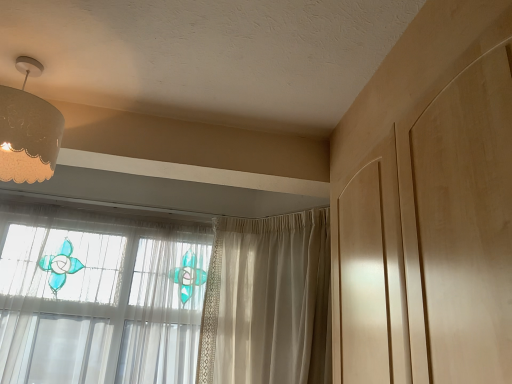
Describe the element at coordinates (28, 130) in the screenshot. I see `matte white lampshade at upper left` at that location.

This screenshot has height=384, width=512. What are the coordinates of `matte white lampshade at upper left` in the screenshot? It's located at (28, 130).

This screenshot has width=512, height=384. What do you see at coordinates (268, 301) in the screenshot?
I see `sheer beige curtain at center` at bounding box center [268, 301].

The width and height of the screenshot is (512, 384). I want to click on sheer beige curtain at center, so click(268, 301).

You are a GUI agent. You are given a task and a screenshot of the screen. Output one action in this format:
    pyautogui.click(x=<x>, y=<y>)
    Task: Click on the matte white lampshade at upper left
    Image resolution: width=512 pixels, height=384 pixels.
    Given the screenshot: What is the action you would take?
    pyautogui.click(x=28, y=130)

Considering the positions of objects matte white lampshade at upper left and sheer beige curtain at center in the image provided, who is more to the left, matte white lampshade at upper left or sheer beige curtain at center?

matte white lampshade at upper left is more to the left.

From the picture: Who is more distant, matte white lampshade at upper left or sheer beige curtain at center?

sheer beige curtain at center.

Is point (55, 158) closer or farther from the camera than point (213, 348)?

Clearly, point (55, 158) is closer to the camera than point (213, 348).

From the image's perspective, would you say matte white lampshade at upper left is positioned over sheer beige curtain at center?

Correct, matte white lampshade at upper left appears higher than sheer beige curtain at center in the image.

From a real-world perspective, is matte white lampshade at upper left positioned over sheer beige curtain at center based on gravity?

Correct, in the physical world, matte white lampshade at upper left is higher than sheer beige curtain at center.

Is matte white lampshade at upper left wider or thinner than sheer beige curtain at center?

Considering their sizes, matte white lampshade at upper left looks slimmer than sheer beige curtain at center.

Which of these two, matte white lampshade at upper left or sheer beige curtain at center, stands shorter?

matte white lampshade at upper left.

Is matte white lampshade at upper left bigger than sheer beige curtain at center?

No.

Choose the correct answer: Is matte white lampshade at upper left inside sheer beige curtain at center or outside it?

matte white lampshade at upper left is not enclosed by sheer beige curtain at center.

Is matte white lampshade at upper left far away from sheer beige curtain at center?

Absolutely, matte white lampshade at upper left is distant from sheer beige curtain at center.

Is sheer beige curtain at center at the back of matte white lampshade at upper left?

That's not correct — matte white lampshade at upper left is not looking away from sheer beige curtain at center.

At what (x,y) coordinates should I click in order to perform the action: click on lamp positioned vertically above the sheer beige curtain at center (from a real-world perspective). Please return your answer as a coordinate pair (x, y). This screenshot has width=512, height=384. Looking at the image, I should click on (28, 130).

Between sheer beige curtain at center and matte white lampshade at upper left, which one appears on the left side from the viewer's perspective?

From the viewer's perspective, matte white lampshade at upper left appears more on the left side.

Is sheer beige curtain at center positioned before matte white lampshade at upper left?

No, sheer beige curtain at center is further to the viewer.

Which is in front, point (223, 321) or point (14, 112)?

The point (14, 112) is closer.

From the image's perspective, is sheer beige curtain at center below matte white lampshade at upper left?

Correct, sheer beige curtain at center appears lower than matte white lampshade at upper left in the image.

Consider the image. From a real-world perspective, which is physically below, sheer beige curtain at center or matte white lampshade at upper left?

In real-world perspective, sheer beige curtain at center is lower.

Is sheer beige curtain at center thinner than matte white lampshade at upper left?

No, sheer beige curtain at center is not thinner than matte white lampshade at upper left.

Between sheer beige curtain at center and matte white lampshade at upper left, which one has less height?

matte white lampshade at upper left.

In the scene shown: Considering the sizes of objects sheer beige curtain at center and matte white lampshade at upper left in the image provided, who is bigger, sheer beige curtain at center or matte white lampshade at upper left?

sheer beige curtain at center.

Could matte white lampshade at upper left be considered to be inside sheer beige curtain at center?

Actually, matte white lampshade at upper left is outside sheer beige curtain at center.

Is sheer beige curtain at center next to matte white lampshade at upper left?

No, sheer beige curtain at center is not touching matte white lampshade at upper left.

Does sheer beige curtain at center turn towards matte white lampshade at upper left?

Yes.

What's the angular difference between sheer beige curtain at center and matte white lampshade at upper left's facing directions?

There is a 40.7-degree angle between the facing directions of sheer beige curtain at center and matte white lampshade at upper left.

In the image, there is a matte white lampshade at upper left. At what (x,y) coordinates should I click in order to perform the action: click on curtain below it (from the image's perspective). Please return your answer as a coordinate pair (x, y). This screenshot has width=512, height=384. Looking at the image, I should click on pyautogui.click(x=268, y=301).

Where is `curtain below the matte white lampshade at upper left (from a real-world perspective)`? The height and width of the screenshot is (384, 512). curtain below the matte white lampshade at upper left (from a real-world perspective) is located at coordinates (268, 301).

At what (x,y) coordinates should I click in order to perform the action: click on lamp on the left of the sheer beige curtain at center. Please return your answer as a coordinate pair (x, y). Looking at the image, I should click on (28, 130).